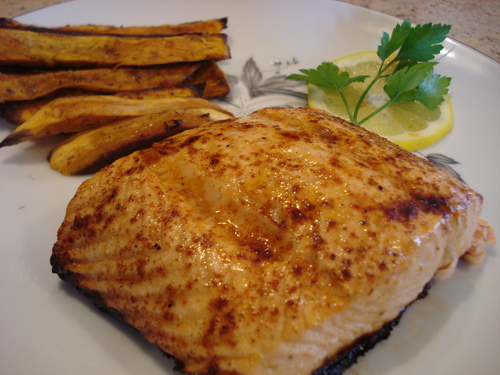
Where is `marble countertop`? The image size is (500, 375). marble countertop is located at coordinates (453, 15), (10, 5).